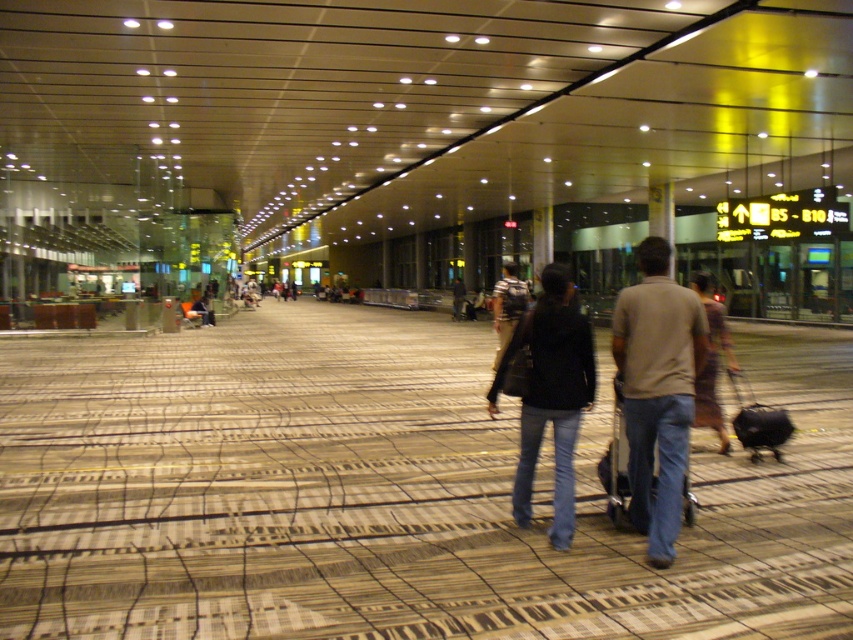
Question: Which object is closer to the camera taking this photo?

Choices:
 (A) dark brown leather jacket at center
 (B) dark brown dress at center
 (C) black fabric suitcase at center
 (D) black matte suitcase at center

Answer: (A)

Question: Which of the following is the farthest from the observer?

Choices:
 (A) (566, 509)
 (B) (514, 289)
 (C) (740, 420)
 (D) (659, 474)

Answer: (B)

Question: Does black matte suitcase at center come behind striped cotton shirt at center?

Choices:
 (A) yes
 (B) no

Answer: (A)

Question: Which object appears farthest from the camera in this image?

Choices:
 (A) black leather jacket at center
 (B) black matte suitcase at center
 (C) black fabric suitcase at center

Answer: (B)

Question: Observing the image, what is the correct spatial positioning of beige cotton shirt at center in reference to black leather jacket at center?

Choices:
 (A) right
 (B) left

Answer: (A)

Question: Does dark brown leather jacket at center lie in front of beige cotton shirt at center?

Choices:
 (A) yes
 (B) no

Answer: (A)